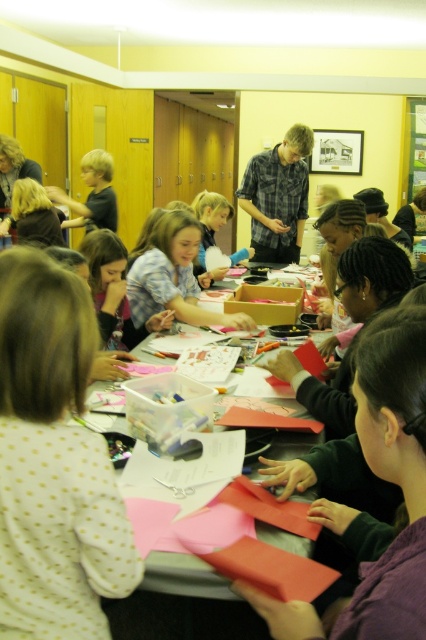
You are a photographer taking a picture of the children at the craft table. You notice the plaid shirt at center and the matte blue shirt at center. Which child should you adjust to ensure both shirts are visible in the frame?

The plaid shirt at center is taller than the matte blue shirt at center, so you should adjust the plaid shirt at center to ensure both shirts are visible in the frame.

You are a teacher observing the craft activity. You notice a point marked at coordinates (x=54, y=461) in the image. Based on the scene description, can you identify what this point corresponds to?

The point at coordinates (x=54, y=461) is on the white dotted shirt at lower left.